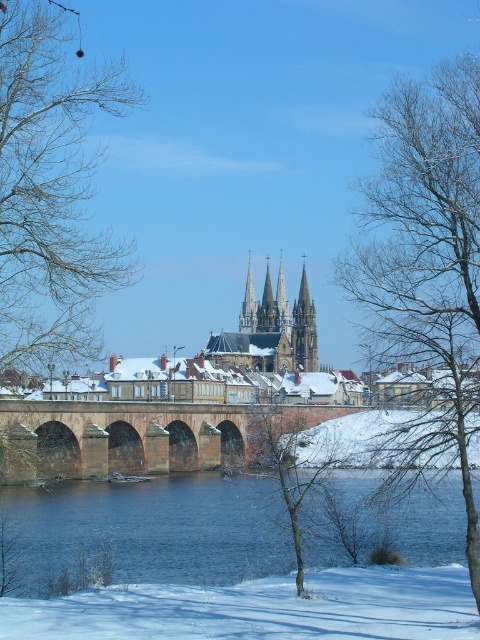
Does blue water at center have a smaller size compared to smooth gray spire at center?

Incorrect, blue water at center is not smaller in size than smooth gray spire at center.

Is the position of blue water at center more distant than that of smooth gray spire at center?

No, blue water at center is closer to the viewer.

Image resolution: width=480 pixels, height=640 pixels. Describe the element at coordinates (156, 528) in the screenshot. I see `blue water at center` at that location.

This screenshot has height=640, width=480. Find the location of `blue water at center`. blue water at center is located at coordinates (156, 528).

Based on the photo, which of these two, white powdery snow at lower center or smooth gray spire at center, stands taller?

smooth gray spire at center

Can you confirm if white powdery snow at lower center is bigger than smooth gray spire at center?

Actually, white powdery snow at lower center might be smaller than smooth gray spire at center.

Between point (342, 628) and point (255, 308), which one is positioned behind?

Positioned behind is point (255, 308).

Where is `white powdery snow at lower center`? The height and width of the screenshot is (640, 480). white powdery snow at lower center is located at coordinates (261, 608).

Between white powdery snow at lower center and brown stone bridge at center, which one appears on the left side from the viewer's perspective?

brown stone bridge at center is more to the left.

Identify the location of white powdery snow at lower center. The height and width of the screenshot is (640, 480). (261, 608).

You are a GUI agent. You are given a task and a screenshot of the screen. Output one action in this format:
    pyautogui.click(x=<x>, y=<y>)
    Task: Click on the white powdery snow at lower center
    This screenshot has height=640, width=480.
    Given the screenshot: What is the action you would take?
    pyautogui.click(x=261, y=608)